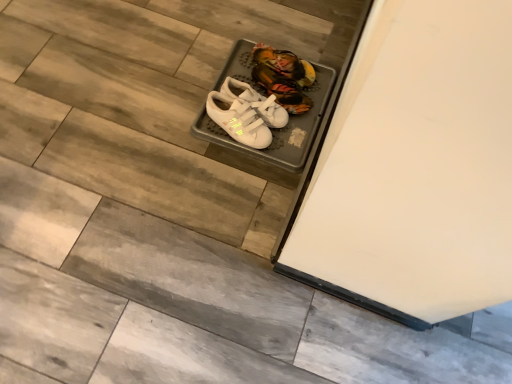
Question: Does white velcro sneakers at center, which is the first footwear in back-to-front order, have a greater height compared to white velcro sneakers at center, which appears as the third footwear when viewed from the back?

Choices:
 (A) no
 (B) yes

Answer: (A)

Question: Is white velcro sneakers at center, the 3th footwear when ordered from front to back, not within white velcro sneakers at center, which appears as the third footwear when viewed from the back?

Choices:
 (A) yes
 (B) no

Answer: (A)

Question: Considering the relative sizes of white velcro sneakers at center, the 3th footwear when ordered from front to back, and white velcro sneakers at center, positioned as the 1th footwear in front-to-back order, in the image provided, is white velcro sneakers at center, the 3th footwear when ordered from front to back, shorter than white velcro sneakers at center, positioned as the 1th footwear in front-to-back order,?

Choices:
 (A) yes
 (B) no

Answer: (A)

Question: Does white velcro sneakers at center, which is the first footwear in back-to-front order, have a smaller size compared to white velcro sneakers at center, which appears as the third footwear when viewed from the back?

Choices:
 (A) yes
 (B) no

Answer: (A)

Question: From a real-world perspective, is white velcro sneakers at center, which is the first footwear in back-to-front order, physically below white velcro sneakers at center, positioned as the 1th footwear in front-to-back order?

Choices:
 (A) yes
 (B) no

Answer: (A)

Question: Is white velcro sneakers at center, which is the first footwear in back-to-front order, to the left of white velcro sneakers at center, positioned as the 1th footwear in front-to-back order, from the viewer's perspective?

Choices:
 (A) yes
 (B) no

Answer: (B)

Question: Would you say white matte sneakers at center, which is the 2th footwear in back-to-front order, is part of white velcro sneakers at center, the 3th footwear when ordered from front to back,'s contents?

Choices:
 (A) yes
 (B) no

Answer: (B)

Question: Is white velcro sneakers at center, which is the first footwear in back-to-front order, bigger than white matte sneakers at center, which is the 2th footwear in back-to-front order?

Choices:
 (A) yes
 (B) no

Answer: (B)

Question: Considering the relative sizes of white velcro sneakers at center, the 3th footwear when ordered from front to back, and white matte sneakers at center, which is the 2th footwear in back-to-front order, in the image provided, is white velcro sneakers at center, the 3th footwear when ordered from front to back, thinner than white matte sneakers at center, which is the 2th footwear in back-to-front order,?

Choices:
 (A) yes
 (B) no

Answer: (B)

Question: Is white velcro sneakers at center, the 3th footwear when ordered from front to back, facing away from white matte sneakers at center, which is the 2th footwear in back-to-front order?

Choices:
 (A) no
 (B) yes

Answer: (A)

Question: From the image's perspective, is white velcro sneakers at center, which is the first footwear in back-to-front order, below white matte sneakers at center, which is the 2th footwear in back-to-front order?

Choices:
 (A) yes
 (B) no

Answer: (B)

Question: From a real-world perspective, is white velcro sneakers at center, the 3th footwear when ordered from front to back, physically above white matte sneakers at center, positioned as the 2th footwear in front-to-back order?

Choices:
 (A) no
 (B) yes

Answer: (A)

Question: Considering the relative sizes of white matte sneakers at center, positioned as the 2th footwear in front-to-back order, and white velcro sneakers at center, the 3th footwear when ordered from front to back, in the image provided, is white matte sneakers at center, positioned as the 2th footwear in front-to-back order, smaller than white velcro sneakers at center, the 3th footwear when ordered from front to back,?

Choices:
 (A) yes
 (B) no

Answer: (B)